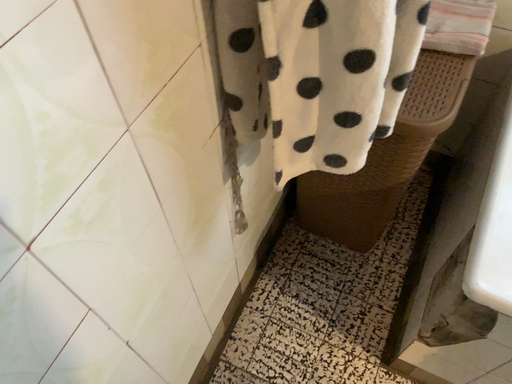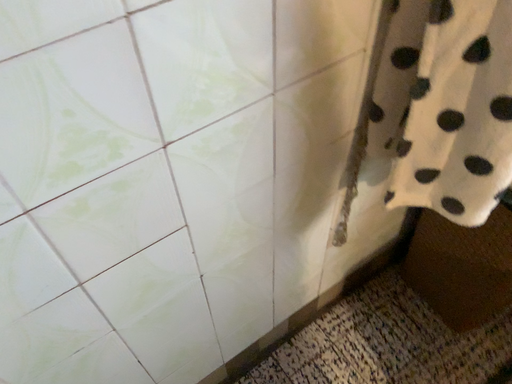
Question: How did the camera likely rotate when shooting the video?

Choices:
 (A) rotated downward
 (B) rotated upward

Answer: (B)